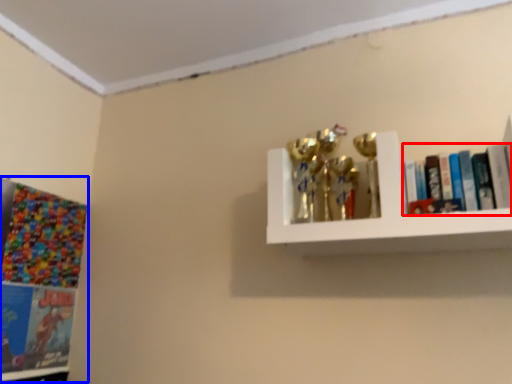
Question: Among these objects, which one is nearest to the camera, book (highlighted by a red box) or comic book (highlighted by a blue box)?

Choices:
 (A) book
 (B) comic book

Answer: (A)